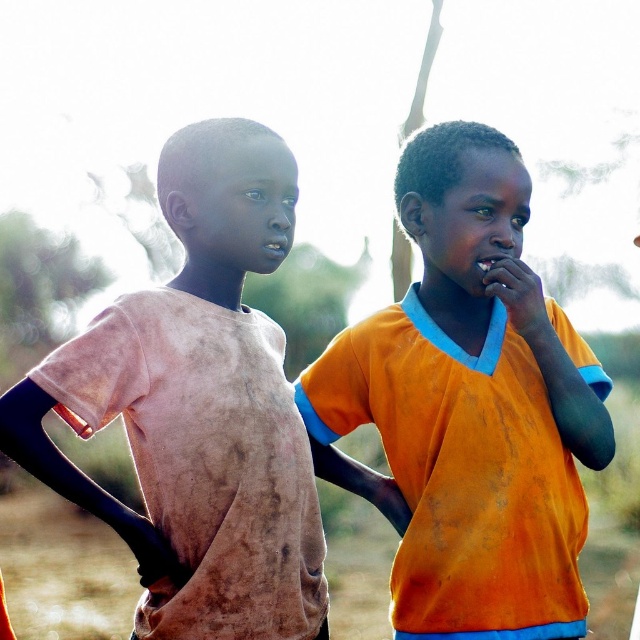
Is point (480, 481) in front of point (150, 525)?

No, (480, 481) is behind (150, 525).

From the picture: Is orange fabric shirt at center positioned behind dirty pink shirt at left?

Yes, orange fabric shirt at center is further from the viewer.

The width and height of the screenshot is (640, 640). I want to click on orange fabric shirt at center, so click(x=468, y=406).